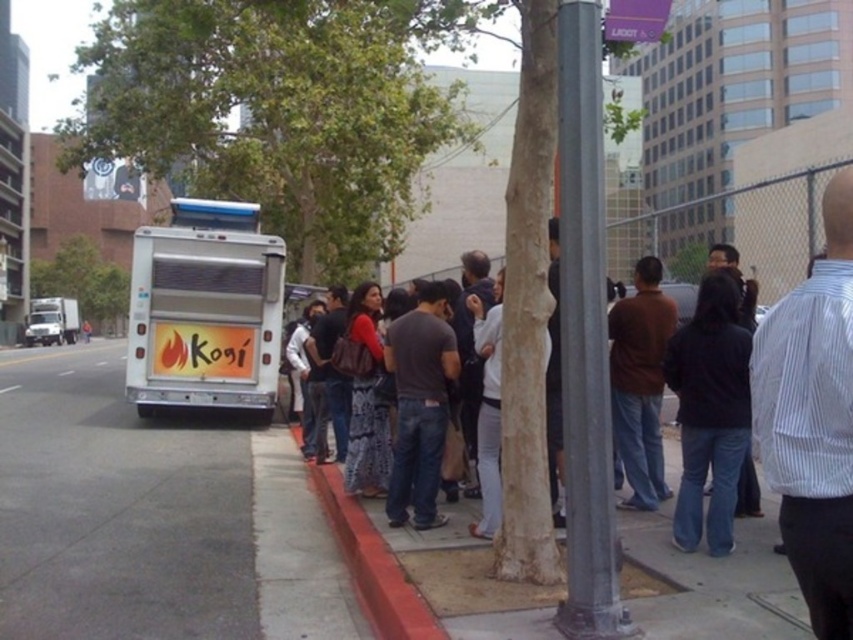
From the picture: You are a delivery person trying to navigate through the crowd near the food truck. There is a gray metallic pole at center and a brushed metal sign at upper center. How far apart are these two objects?

The gray metallic pole at center and the brushed metal sign at upper center are 20.77 inches apart.

You are standing at the point marked by the coordinates point (206,310) in the image. What object are you currently standing on?

You are standing on the metallic silver food truck at left as the point (206,310) is located on it.

You are a city planner analyzing the layout of this urban scene. The gray metallic pole at center and the brushed metal sign at upper center are both part of the infrastructure. Which of these two objects has a smaller width?

The gray metallic pole at center has a smaller width than the brushed metal sign at upper center.